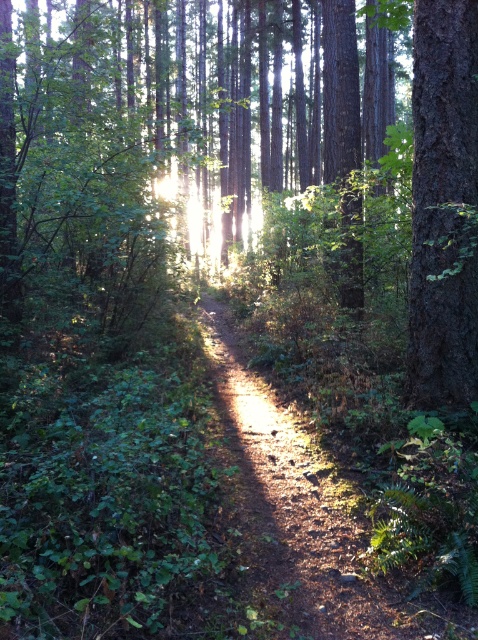
Question: Which of these objects is positioned farthest from the smooth bark tree at right?

Choices:
 (A) brown textured tree at center
 (B) dirt path at center

Answer: (A)

Question: Is brown textured tree at center bigger than smooth bark tree at right?

Choices:
 (A) yes
 (B) no

Answer: (A)

Question: Which point appears farthest from the camera in this image?

Choices:
 (A) (425, 19)
 (B) (436, 45)

Answer: (A)

Question: From the image, what is the correct spatial relationship of dirt path at center in relation to smooth bark tree at right?

Choices:
 (A) left
 (B) right

Answer: (A)

Question: Which object is closer to the camera taking this photo?

Choices:
 (A) dirt path at center
 (B) brown textured tree at center
 (C) smooth bark tree at right

Answer: (A)

Question: Can you confirm if brown textured tree at center is positioned to the right of dirt path at center?

Choices:
 (A) yes
 (B) no

Answer: (B)